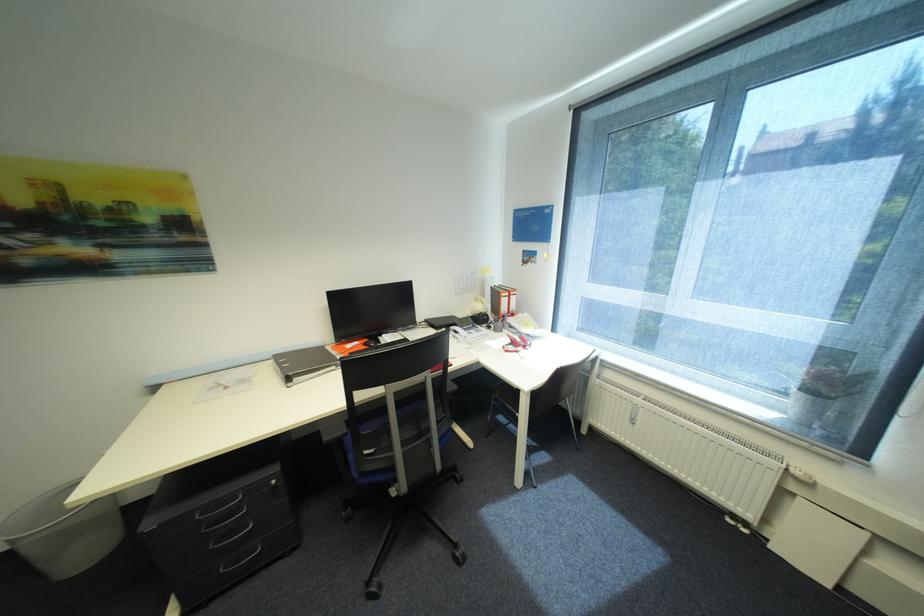
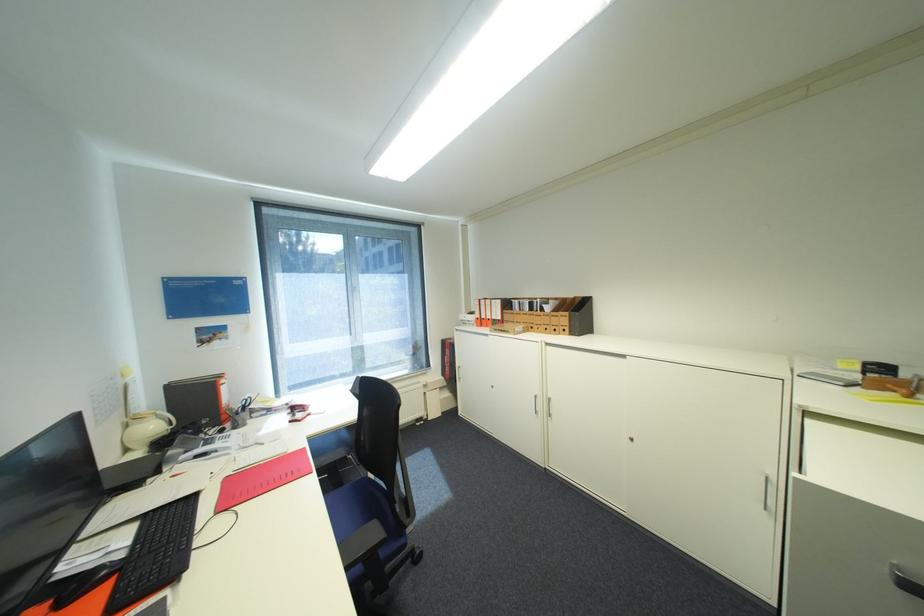
In the second image, find the point that corresponds to pixel 488 307 in the first image.

(161, 427)